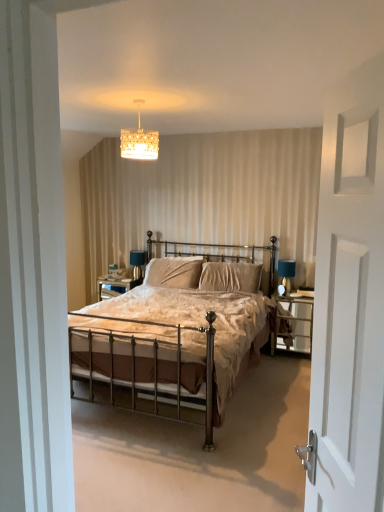
Question: Does matte black table lamp at right appear on the right side of white matte screen door at right?

Choices:
 (A) no
 (B) yes

Answer: (B)

Question: Is matte black table lamp at right placed right next to white matte screen door at right?

Choices:
 (A) no
 (B) yes

Answer: (A)

Question: Can you confirm if matte black table lamp at right is bigger than white matte screen door at right?

Choices:
 (A) no
 (B) yes

Answer: (A)

Question: Is matte black table lamp at right aimed at white matte screen door at right?

Choices:
 (A) yes
 (B) no

Answer: (A)

Question: Is matte black table lamp at right positioned with its back to white matte screen door at right?

Choices:
 (A) yes
 (B) no

Answer: (B)

Question: From a real-world perspective, is matte black table lamp at right located beneath white matte screen door at right?

Choices:
 (A) no
 (B) yes

Answer: (B)

Question: Is bronze metal bed at center turned away from metallic silver nightstand at right?

Choices:
 (A) yes
 (B) no

Answer: (B)

Question: From a real-world perspective, does bronze metal bed at center stand above metallic silver nightstand at right?

Choices:
 (A) no
 (B) yes

Answer: (B)

Question: Is bronze metal bed at center not near metallic silver nightstand at right?

Choices:
 (A) yes
 (B) no

Answer: (B)

Question: Considering the relative positions of bronze metal bed at center and metallic silver nightstand at right in the image provided, is bronze metal bed at center to the right of metallic silver nightstand at right from the viewer's perspective?

Choices:
 (A) no
 (B) yes

Answer: (A)

Question: Does bronze metal bed at center come in front of metallic silver nightstand at right?

Choices:
 (A) no
 (B) yes

Answer: (B)

Question: Is bronze metal bed at center bigger than metallic silver nightstand at right?

Choices:
 (A) no
 (B) yes

Answer: (B)

Question: Are white matte screen door at right and gold textured chandelier at upper center beside each other?

Choices:
 (A) yes
 (B) no

Answer: (B)